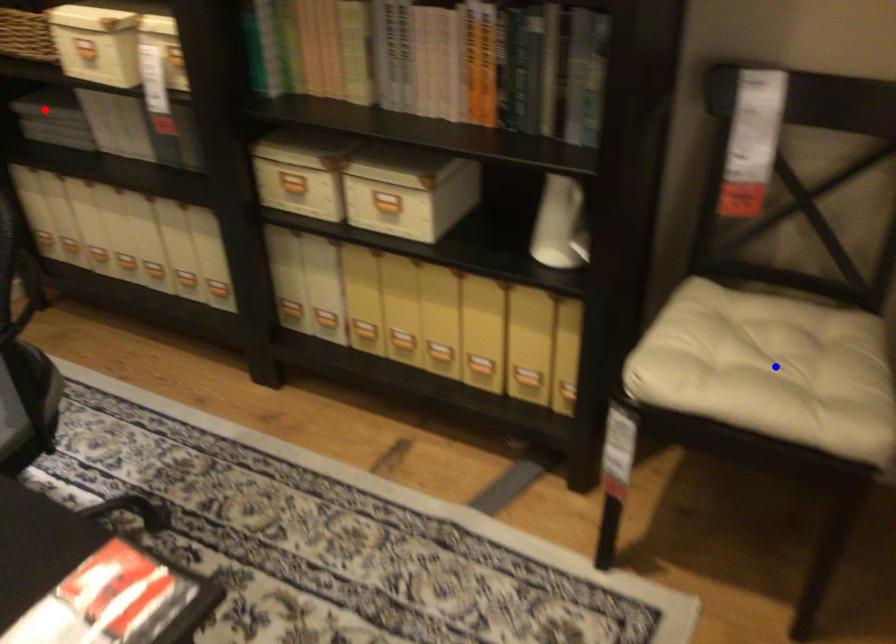
Question: Two points are marked on the image. Which point is closer to the camera?

Choices:
 (A) Blue point is closer.
 (B) Red point is closer.

Answer: (A)